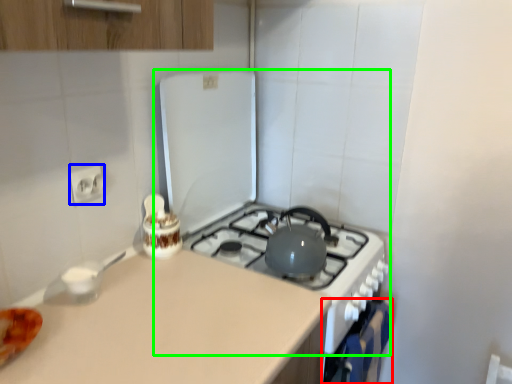
Question: Based on their relative distances, which object is nearer to oven (highlighted by a red box)? Choose from electric outlet (highlighted by a blue box) and appliance (highlighted by a green box).

Choices:
 (A) electric outlet
 (B) appliance

Answer: (B)